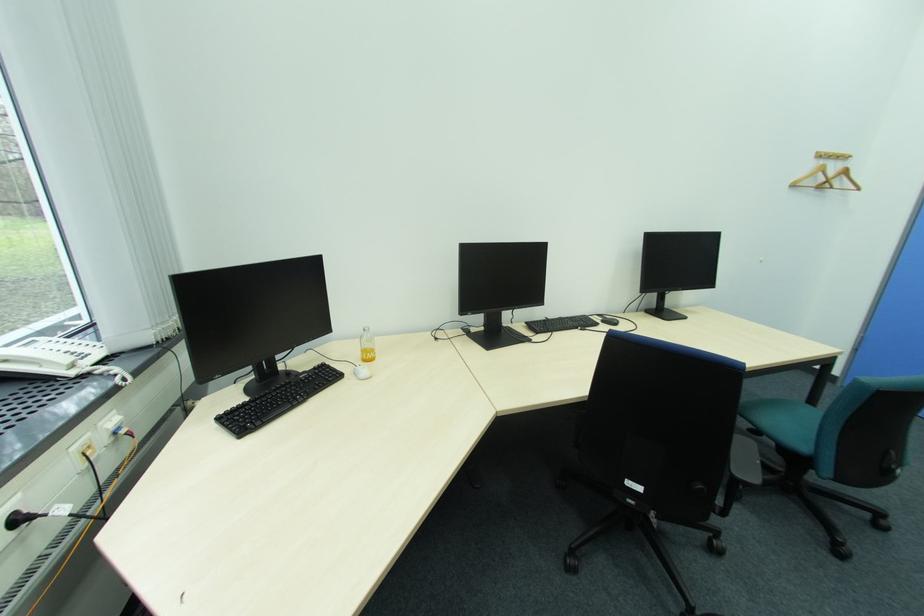
Where would you sit the teal chair sitting surface? Please return your answer as a coordinate pair (x, y).

(784, 422)